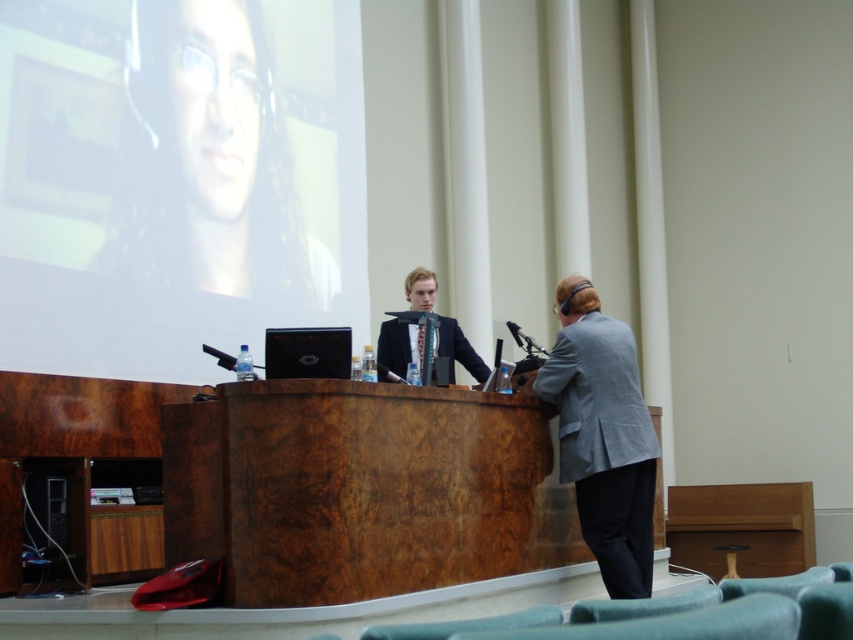
Question: Based on their relative distances, which object is nearer to the matte black laptop at upper left?

Choices:
 (A) dark gray fabric business suit at center
 (B) gray wool suit at right

Answer: (A)

Question: Is matte black laptop at upper left to the left of gray wool suit at right from the viewer's perspective?

Choices:
 (A) no
 (B) yes

Answer: (B)

Question: Observing the image, what is the correct spatial positioning of matte black laptop at upper left in reference to gray wool suit at right?

Choices:
 (A) above
 (B) below

Answer: (A)

Question: Is gray wool suit at right thinner than dark gray fabric business suit at center?

Choices:
 (A) no
 (B) yes

Answer: (B)

Question: Which of the following is the closest to the observer?

Choices:
 (A) (625, 336)
 (B) (480, 358)
 (C) (189, 232)

Answer: (A)

Question: Which of the following is the farthest from the observer?

Choices:
 (A) dark gray fabric business suit at center
 (B) matte black laptop at upper left
 (C) gray wool suit at right

Answer: (B)